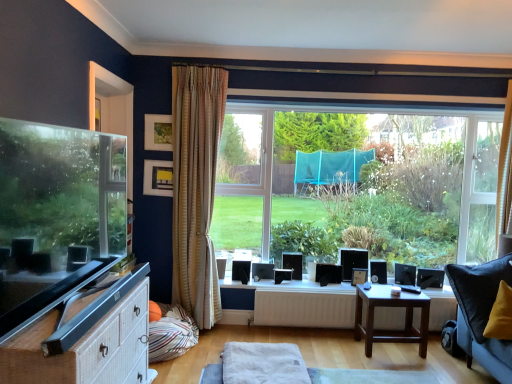
Question: Is wooden picture frame at upper center, the 3th picture frame from the back, inside the boundaries of white matte radiator at center, or outside?

Choices:
 (A) outside
 (B) inside

Answer: (A)

Question: Is wooden picture frame at upper center, which ranks as the third picture frame in bottom-to-top order, taller or shorter than white matte radiator at center?

Choices:
 (A) short
 (B) tall

Answer: (B)

Question: Estimate the real-world distances between objects in this image. Which object is farther from the transparent glass window at center?

Choices:
 (A) white soft towel at center
 (B) wooden picture frame at upper center, which is the 1th picture frame from left to right
 (C) striped fabric pillow at lower left
 (D) matte yellow picture frame at upper left, positioned as the 2th picture frame in left-to-right order
 (E) white striped curtain at upper right, the second curtain positioned from the left

Answer: (B)

Question: Which of these objects is positioned closest to the white matte radiator at center?

Choices:
 (A) black plastic speaker at lower right
 (B) matte black tv at left
 (C) matte black picture frame at upper center, which is counted as the 3th picture frame, starting from the top
 (D) matte yellow picture frame at upper left, positioned as the 2th picture frame in top-to-bottom order
 (E) white striped curtain at upper right, the second curtain positioned from the left

Answer: (C)